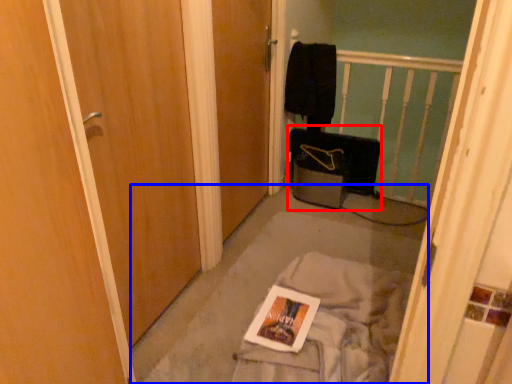
Question: Which object appears farthest to the camera in this image, luggage (highlighted by a red box) or concrete (highlighted by a blue box)?

Choices:
 (A) luggage
 (B) concrete

Answer: (A)